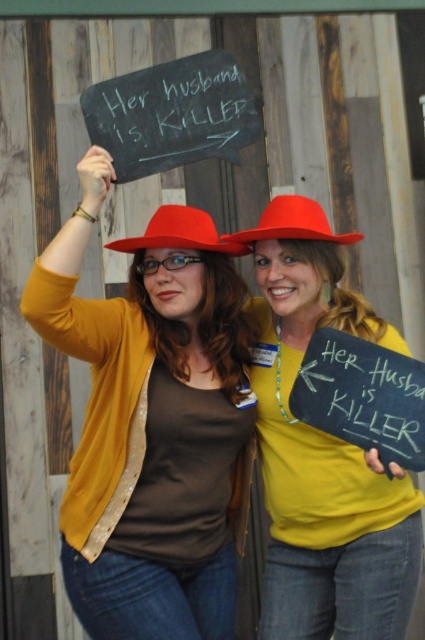
Does black chalkboard at upper center have a lesser width compared to matte red cowboy hat at center?

Incorrect, black chalkboard at upper center's width is not less than matte red cowboy hat at center's.

Measure the distance between black chalkboard at upper center and matte red cowboy hat at center.

black chalkboard at upper center is 12.90 inches away from matte red cowboy hat at center.

The width and height of the screenshot is (425, 640). I want to click on black chalkboard at upper center, so click(x=172, y=115).

Is point (195, 436) more distant than point (288, 209)?

No, (195, 436) is in front of (288, 209).

Is matte black hat at upper left bigger than matte yellow shirt at center?

Yes.

Is point (130, 336) farther from camera compared to point (376, 563)?

No, (130, 336) is closer to viewer.

At what (x,y) coordinates should I click in order to perform the action: click on matte black hat at upper left. Please return your answer as a coordinate pair (x, y). Looking at the image, I should click on (152, 422).

Does point (286, 269) come behind point (183, 109)?

Yes, point (286, 269) is farther from viewer.

Between matte yellow shirt at center and black chalkboard at upper center, which one appears on the left side from the viewer's perspective?

black chalkboard at upper center

Does point (401, 532) lie behind point (152, 147)?

That is True.

Find the location of a particular element. This screenshot has width=425, height=640. matte yellow shirt at center is located at coordinates (323, 451).